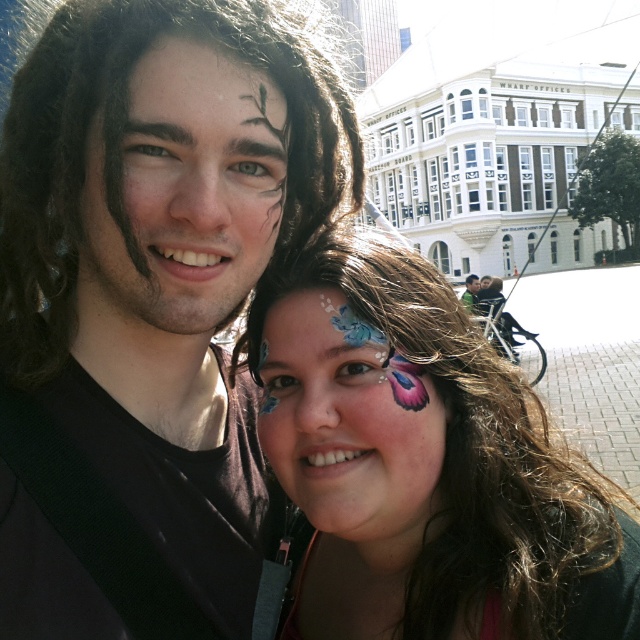
Measure the distance between matte black hair at center and camera.

117.76 feet

Can you confirm if matte black hair at center is smaller than matte black shirt at center?

Actually, matte black hair at center might be larger than matte black shirt at center.

Between point (48, 108) and point (470, 280), which one is positioned behind?

The point (470, 280) is behind.

Where is `matte black hair at center`? The width and height of the screenshot is (640, 640). matte black hair at center is located at coordinates pyautogui.click(x=148, y=298).

Does matte black face paint at upper left have a lesser width compared to matte butterfly face paint at center?

No.

Who is shorter, matte black face paint at upper left or matte butterfly face paint at center?

matte butterfly face paint at center

Where is `matte black face paint at upper left`? The image size is (640, 640). matte black face paint at upper left is located at coordinates (182, 198).

Which is below, matte black face paint at upper left or matte black shirt at center?

Positioned lower is matte black shirt at center.

Is point (170, 145) farther from viewer compared to point (476, 300)?

No, it is in front of (476, 300).

Which is behind, point (236, 292) or point (468, 275)?

The point (468, 275) is behind.

The image size is (640, 640). In order to click on matte black face paint at upper left in this screenshot , I will do `click(182, 198)`.